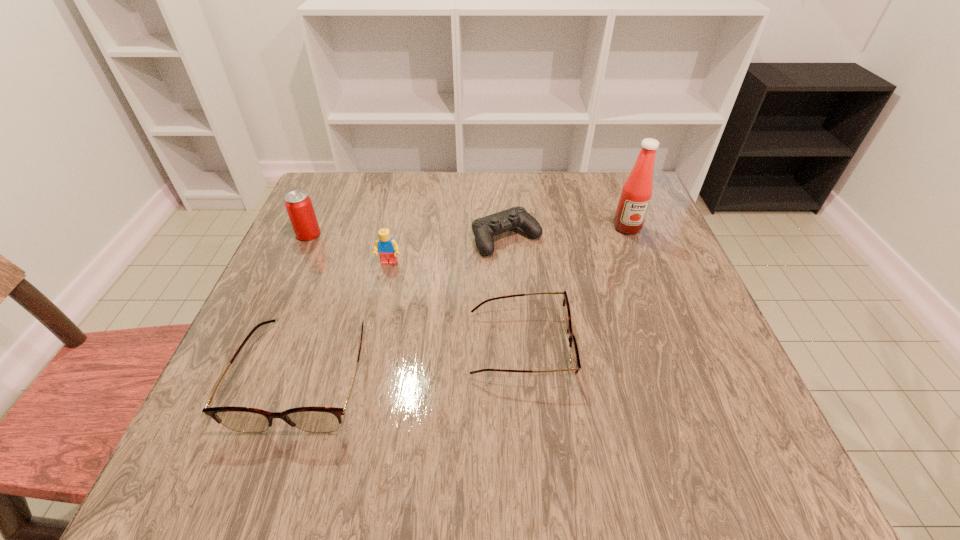
You are a GUI agent. You are given a task and a screenshot of the screen. Output one action in this format:
    pyautogui.click(x=<x>, y=<y>)
    Task: Click on the left spectacles
    The width and height of the screenshot is (960, 540).
    Given the screenshot: What is the action you would take?
    pyautogui.click(x=313, y=419)

At what (x,y) coordinates should I click in order to perform the action: click on the taller spectacles. Please return your answer as a coordinate pair (x, y). Looking at the image, I should click on (313, 419).

Identify the location of the right spectacles. (574, 353).

Locate an element on the screen. The height and width of the screenshot is (540, 960). the rightmost object is located at coordinates (636, 193).

I want to click on condiment, so click(x=636, y=193).

Where is `can`? The height and width of the screenshot is (540, 960). can is located at coordinates (298, 204).

Image resolution: width=960 pixels, height=540 pixels. Identify the location of Lego. (387, 248).

Where is `control`? This screenshot has height=540, width=960. control is located at coordinates tap(484, 228).

Locate an element on the screen. This screenshot has width=960, height=540. vacant region located 0.220m on the face of the right spectacles is located at coordinates (684, 346).

Where is `vacant space located on the front-facing side of the rightmost object`? Image resolution: width=960 pixels, height=540 pixels. vacant space located on the front-facing side of the rightmost object is located at coordinates (672, 344).